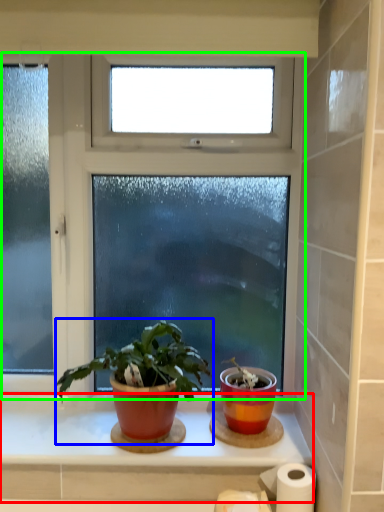
Question: Estimate the real-world distances between objects in this image. Which object is farther from window sill (highlighted by a red box), houseplant (highlighted by a blue box) or window (highlighted by a green box)?

Choices:
 (A) houseplant
 (B) window

Answer: (B)